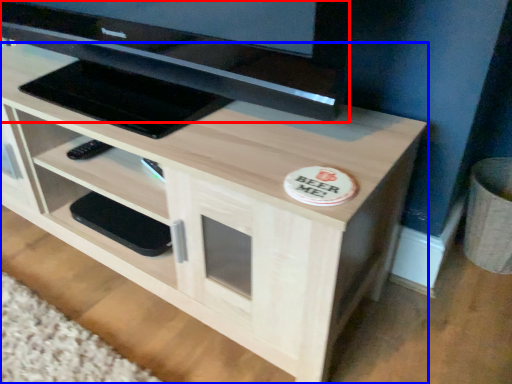
Question: Which object is further to the camera taking this photo, television (highlighted by a red box) or desk (highlighted by a blue box)?

Choices:
 (A) television
 (B) desk

Answer: (B)